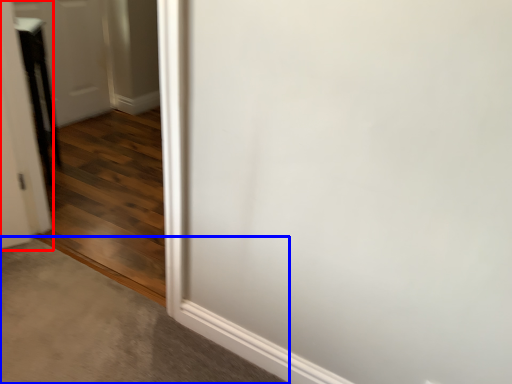
Question: Which object appears farthest to the camera in this image, door (highlighted by a red box) or concrete (highlighted by a blue box)?

Choices:
 (A) door
 (B) concrete

Answer: (A)